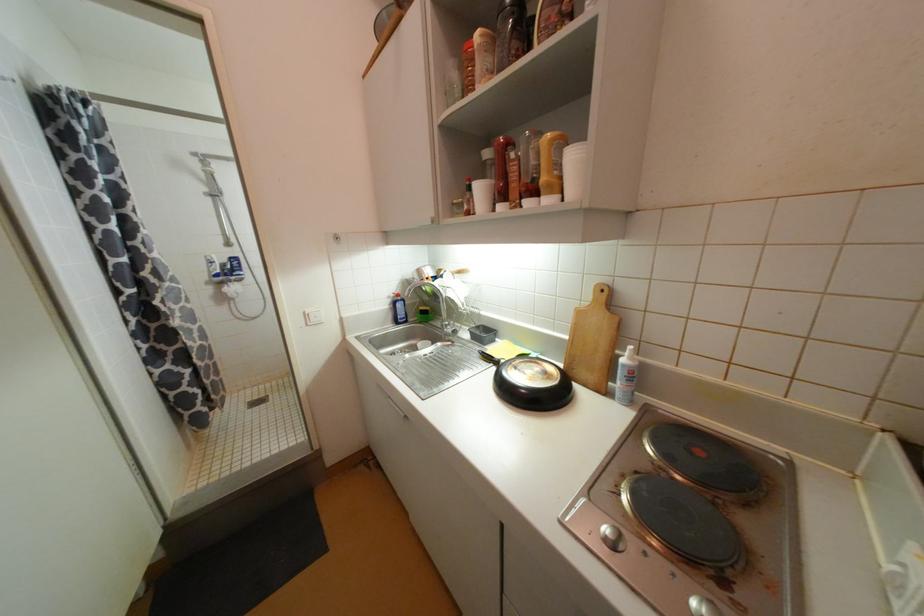
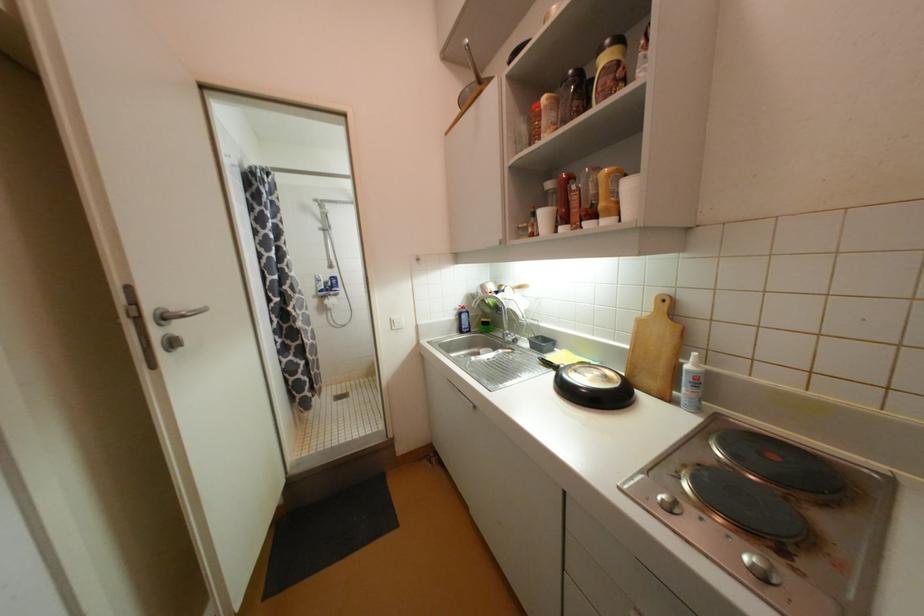
In the second image, find the point that corresponds to [613,531] in the first image.

(669, 498)